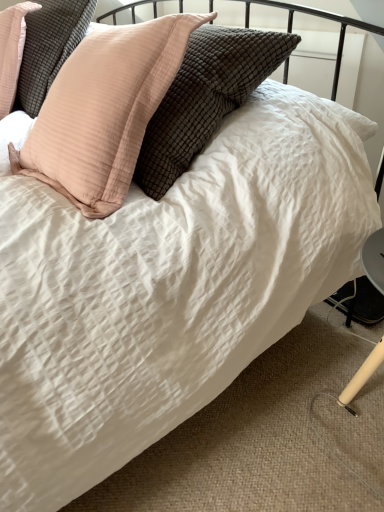
Question: From the image's perspective, is matte pink pillow at upper left, which is counted as the 2th pillow, starting from the left, located above or below peach striped pillow at upper left, acting as the 2th pillow starting from the right?

Choices:
 (A) below
 (B) above

Answer: (A)

Question: In terms of width, does matte pink pillow at upper left, marked as the 1th pillow in a right-to-left arrangement, look wider or thinner when compared to peach striped pillow at upper left, which appears as the first pillow when viewed from the left?

Choices:
 (A) thin
 (B) wide

Answer: (A)

Question: Considering their positions, is matte pink pillow at upper left, which is counted as the 2th pillow, starting from the left, located in front of or behind peach striped pillow at upper left, acting as the 2th pillow starting from the right?

Choices:
 (A) front
 (B) behind

Answer: (A)

Question: Is point (26, 56) closer or farther from the camera than point (160, 49)?

Choices:
 (A) closer
 (B) farther

Answer: (B)

Question: From the image's perspective, is peach striped pillow at upper left, acting as the 2th pillow starting from the right, above or below matte pink pillow at upper left, which is counted as the 2th pillow, starting from the left?

Choices:
 (A) above
 (B) below

Answer: (A)

Question: Is peach striped pillow at upper left, which appears as the first pillow when viewed from the left, in front of or behind matte pink pillow at upper left, marked as the 1th pillow in a right-to-left arrangement, in the image?

Choices:
 (A) front
 (B) behind

Answer: (B)

Question: Based on their sizes in the image, would you say peach striped pillow at upper left, which appears as the first pillow when viewed from the left, is bigger or smaller than matte pink pillow at upper left, marked as the 1th pillow in a right-to-left arrangement?

Choices:
 (A) small
 (B) big

Answer: (A)